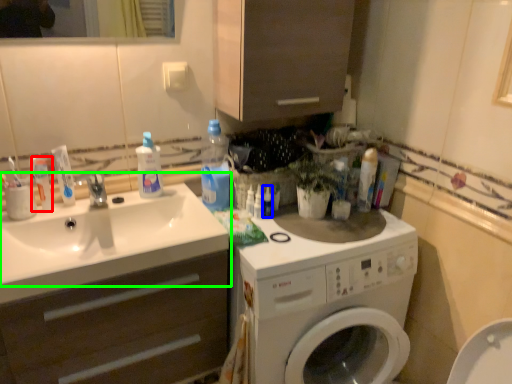
Question: Estimate the real-world distances between objects in this image. Which object is closer to toothpaste (highlighted by a red box), toiletry (highlighted by a blue box) or sink (highlighted by a green box)?

Choices:
 (A) toiletry
 (B) sink

Answer: (B)